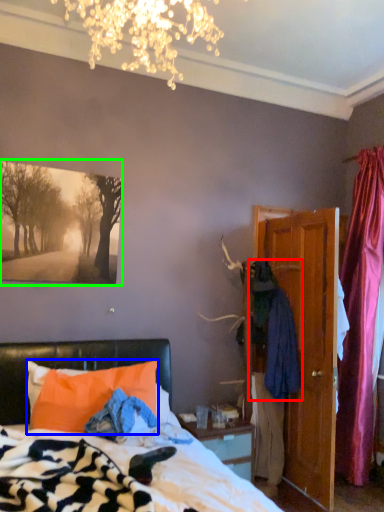
Question: Which object is positioned closest to clothing (highlighted by a red box)? Select from pillow (highlighted by a blue box) and picture frame (highlighted by a green box).

Choices:
 (A) pillow
 (B) picture frame

Answer: (A)